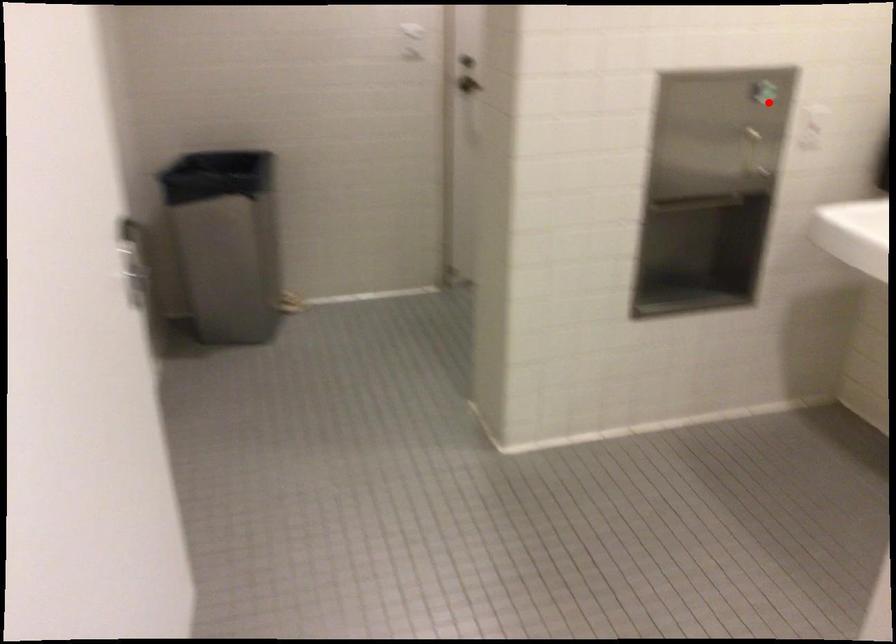
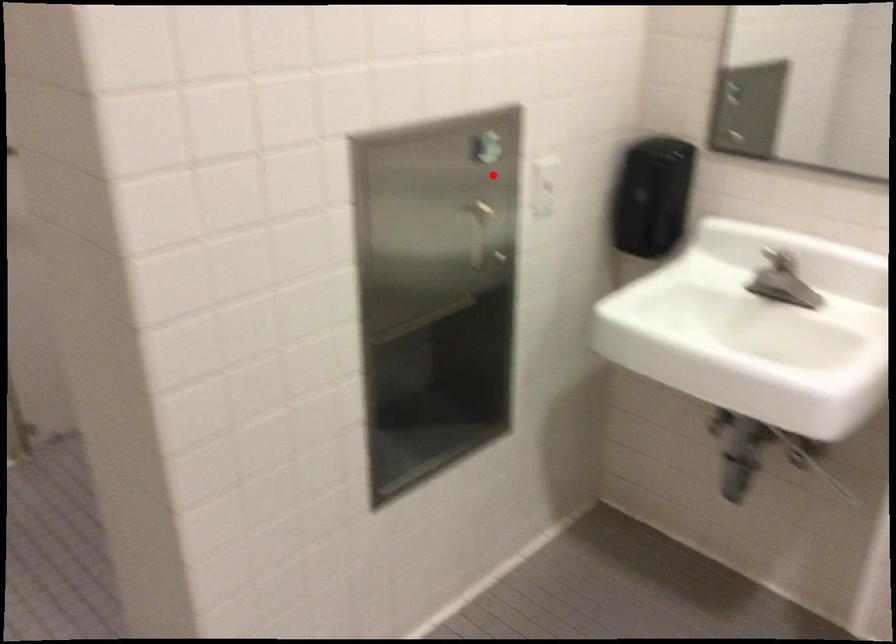
I am providing you with two images of the same scene from different viewpoints. A red point is marked on the first image and another point is marked on the second image. Is the marked point in image1 the same physical position as the marked point in image2?

Yes